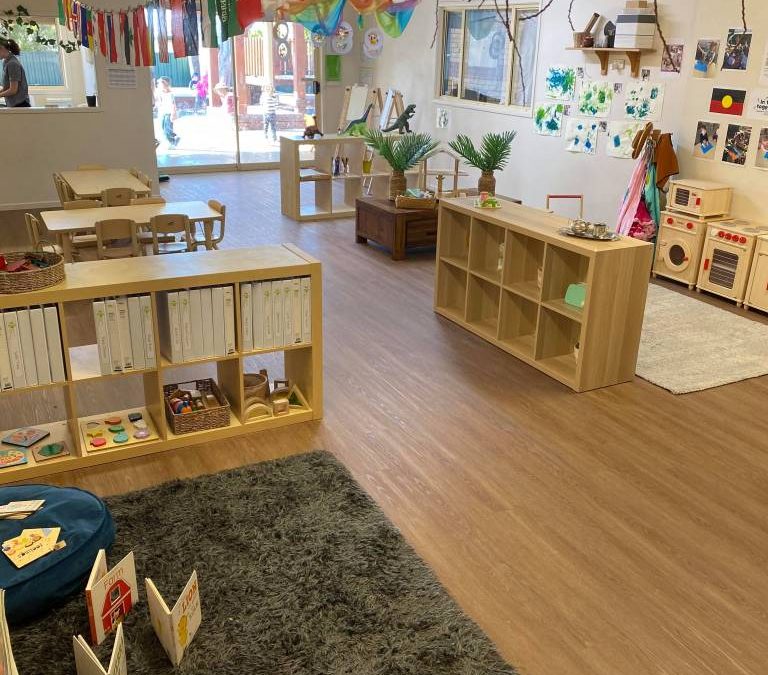
The image size is (768, 675). I want to click on flag on wall, so click(729, 105).